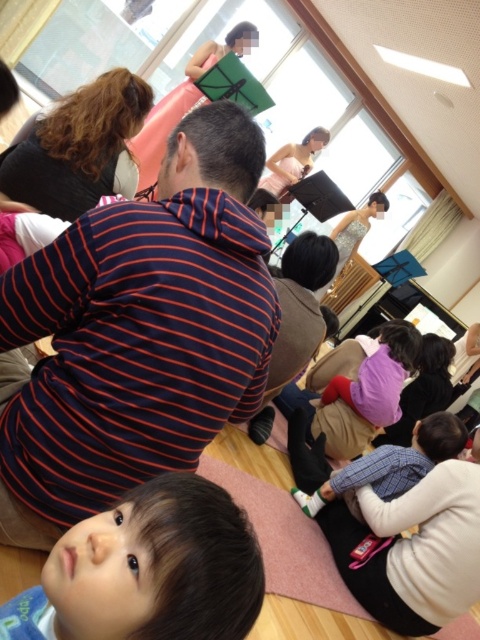
Is point (327, 358) positioned in front of point (367, 470)?

That is False.

Between point (349, 433) and point (428, 458), which one is positioned behind?

Point (349, 433)

Locate an element on the screen. purple fleece at center is located at coordinates (360, 388).

Is brown hair at lower left bigger than purple fleece at center?

No, brown hair at lower left is not bigger than purple fleece at center.

Which is in front, point (132, 547) or point (398, 410)?

Positioned in front is point (132, 547).

At what (x,y) coordinates should I click in order to perform the action: click on brown hair at lower left. Please return your answer as a coordinate pair (x, y). This screenshot has width=480, height=640. Looking at the image, I should click on (149, 570).

Is striped fabric at center to the left of purple fleece at center from the viewer's perspective?

Yes, striped fabric at center is to the left of purple fleece at center.

Is point (83, 296) positioned after point (316, 429)?

No, it is in front of (316, 429).

Between point (191, 116) and point (400, 342), which one is positioned behind?

The point (400, 342) is more distant.

Locate an element on the screen. striped fabric at center is located at coordinates (139, 333).